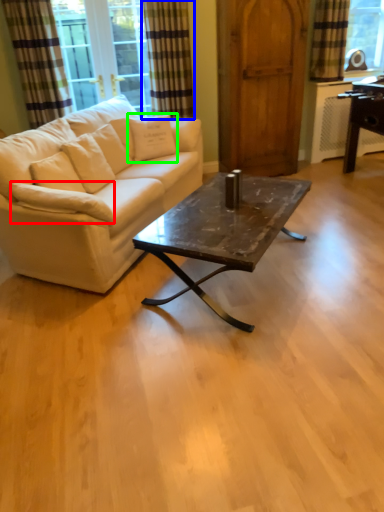
Question: Based on their relative distances, which object is nearer to pillow (highlighted by a red box)? Choose from curtain (highlighted by a blue box) and pillow (highlighted by a green box).

Choices:
 (A) curtain
 (B) pillow

Answer: (B)